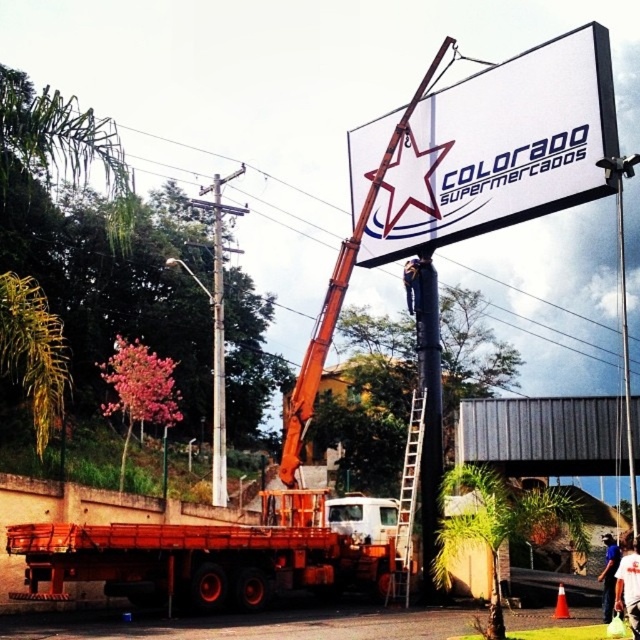
Question: Is orange metallic trailer truck at center above brushed metal pole at upper center?

Choices:
 (A) yes
 (B) no

Answer: (B)

Question: Does white matte sign at upper center have a lesser width compared to white hard hat at center?

Choices:
 (A) yes
 (B) no

Answer: (B)

Question: Which object is farther from the camera taking this photo?

Choices:
 (A) orange traffic cone at center
 (B) orange metallic trailer truck at center

Answer: (A)

Question: Is white matte sign at upper center above brushed metal pole at upper center?

Choices:
 (A) yes
 (B) no

Answer: (A)

Question: Which of the following is the farthest from the observer?

Choices:
 (A) black matte pole at center
 (B) white matte sign at upper center
 (C) blue fabric construction worker at center
 (D) orange metallic crane at upper center

Answer: (D)

Question: Which object is the closest to the white matte sign at upper center?

Choices:
 (A) orange metallic crane at upper center
 (B) black matte pole at center
 (C) white hard hat at center
 (D) metallic ladder at center

Answer: (A)